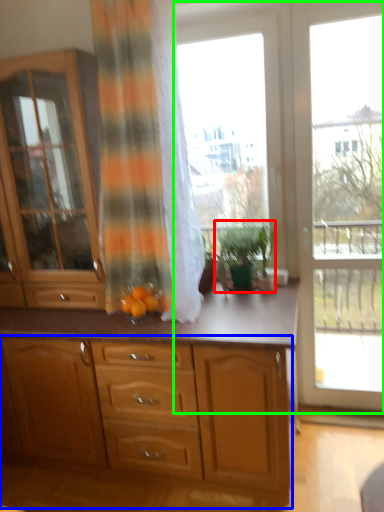
Question: Which object is positioned farthest from houseplant (highlighted by a red box)? Select from cabinetry (highlighted by a blue box) and window frame (highlighted by a green box).

Choices:
 (A) cabinetry
 (B) window frame

Answer: (A)